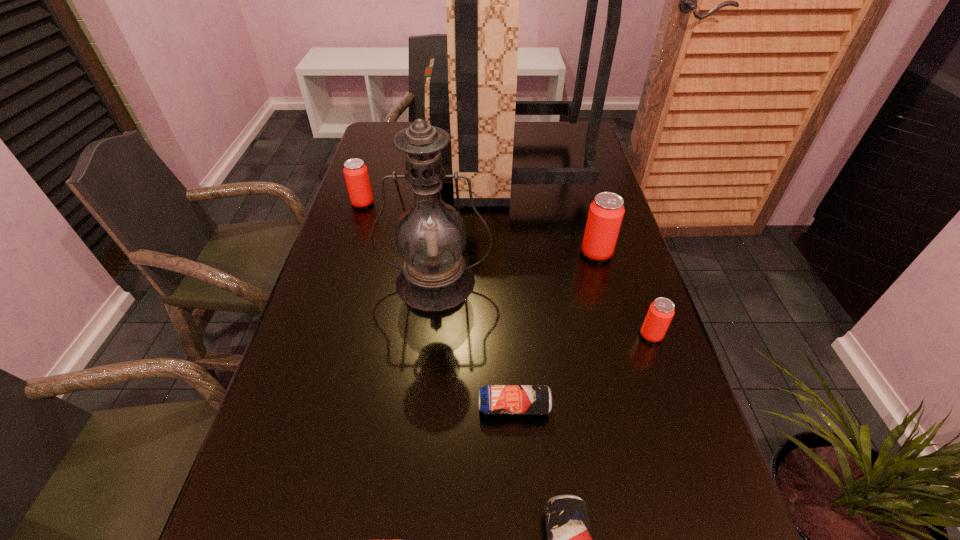
Where is `the smaller blue beer can`? The image size is (960, 540). the smaller blue beer can is located at coordinates (493, 399).

What are the coordinates of `vacant region located on the front face of the backpack` in the screenshot? It's located at (363, 163).

This screenshot has width=960, height=540. Find the location of `free spot located on the front face of the backpack`. free spot located on the front face of the backpack is located at coordinates (384, 163).

Locate an element on the screen. This screenshot has width=960, height=540. vacant region located 0.150m on the front face of the backpack is located at coordinates (387, 163).

Identify the location of vacant space situated on the front of the sixth shortest object. pyautogui.click(x=421, y=423).

Find the location of a particular element. The height and width of the screenshot is (540, 960). vacant point located 0.180m on the front of the tallest beer can is located at coordinates (615, 319).

Find the location of a particular element. Image resolution: width=960 pixels, height=540 pixels. vacant area situated 0.210m on the front of the fourth shortest beer can is located at coordinates (345, 259).

You are a GUI agent. You are given a task and a screenshot of the screen. Output one action in this format:
    pyautogui.click(x=<x>, y=<y>)
    Task: Click on the vacant space located 0.170m on the back of the third nearest object
    This screenshot has width=960, height=540.
    Given the screenshot: What is the action you would take?
    pyautogui.click(x=630, y=272)

This screenshot has width=960, height=540. I want to click on vacant position located 0.080m on the back of the shortest beer can, so click(511, 360).

Image resolution: width=960 pixels, height=540 pixels. Identify the location of object that is at the far edge. (471, 94).